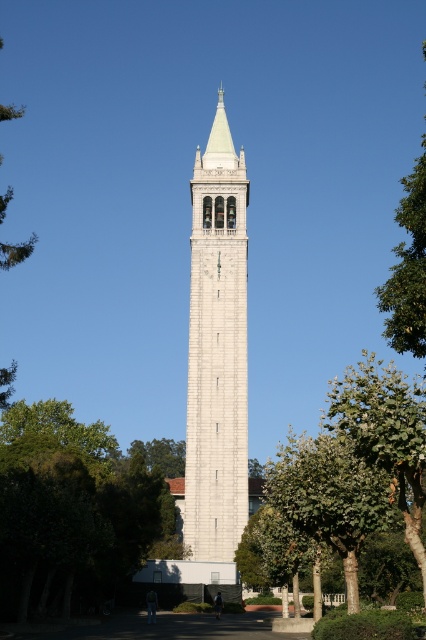
Question: Does green leafy tree at center appear on the left side of green leafy tree at upper right?

Choices:
 (A) no
 (B) yes

Answer: (B)

Question: Which is farther from the green leafy tree at center?

Choices:
 (A) white stone bell tower at center
 (B) green leafy tree at lower left

Answer: (B)

Question: Considering the real-world distances, which object is farthest from the white stone bell tower at center?

Choices:
 (A) green leafy tree at center
 (B) green leafy tree at lower left
 (C) green leafy tree at upper right

Answer: (C)

Question: Which of the following is the closest to the observer?

Choices:
 (A) (236, 477)
 (B) (373, 426)
 (C) (416, 294)
 (D) (146, 544)

Answer: (B)

Question: Observing the image, what is the correct spatial positioning of white stone bell tower at center in reference to green leafy tree at upper right?

Choices:
 (A) left
 (B) right

Answer: (A)

Question: Is white stone bell tower at center positioned behind green leafy tree at center?

Choices:
 (A) yes
 (B) no

Answer: (A)